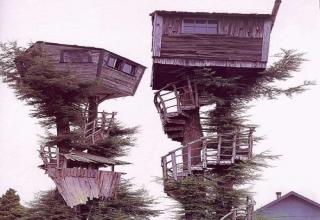
You are a GUI agent. You are given a task and a screenshot of the screen. Output one action in this format:
    pyautogui.click(x=<x>, y=<y>)
    Task: Click on the support beam
    
    Given the screenshot: What is the action you would take?
    [x=102, y=99]